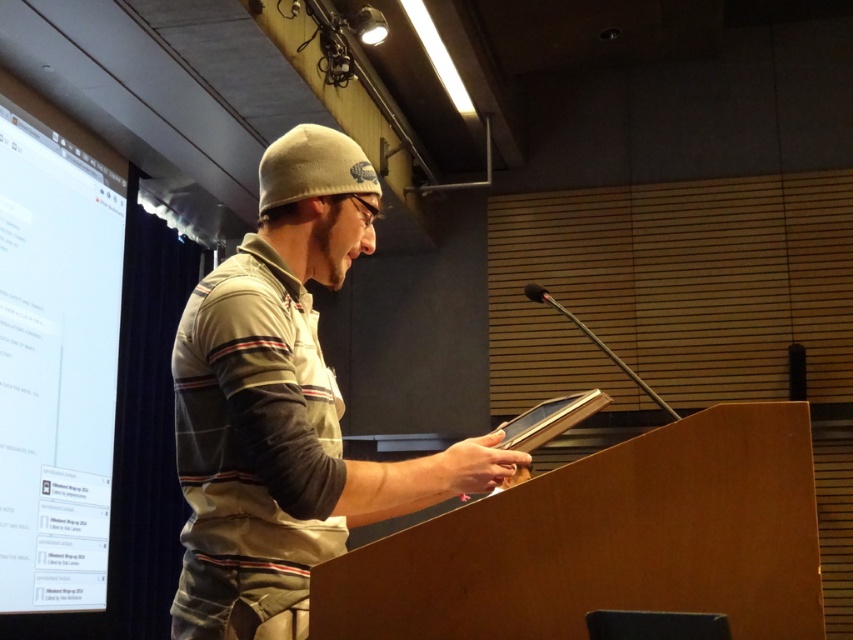
Which is behind, point (285, 460) or point (28, 563)?

Point (28, 563)

Is beige cotton polo shirt at center closer to camera compared to white glossy projection screen at left?

That is True.

This screenshot has width=853, height=640. Find the location of `beige cotton polo shirt at center`. beige cotton polo shirt at center is located at coordinates (253, 451).

Find the location of a particular element. beige cotton polo shirt at center is located at coordinates (253, 451).

Is khaki cotton beanie at center above white glossy projection screen at left?

Yes, khaki cotton beanie at center is above white glossy projection screen at left.

Who is taller, khaki cotton beanie at center or white glossy projection screen at left?

Standing taller between the two is white glossy projection screen at left.

Identify the location of khaki cotton beanie at center. The height and width of the screenshot is (640, 853). (283, 406).

Between point (248, 481) and point (270, 312), which one is positioned in front?

Point (248, 481)

Does khaki cotton beanie at center have a greater width compared to beige cotton polo shirt at center?

Yes, khaki cotton beanie at center is wider than beige cotton polo shirt at center.

Describe the element at coordinates (283, 406) in the screenshot. I see `khaki cotton beanie at center` at that location.

Find the location of `khaki cotton beanie at center`. khaki cotton beanie at center is located at coordinates (283, 406).